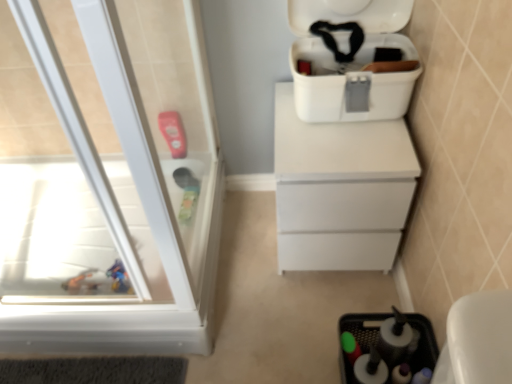
The width and height of the screenshot is (512, 384). In order to click on vacant area that is in front of transparent plastic screen door at left in this screenshot , I will do `click(225, 329)`.